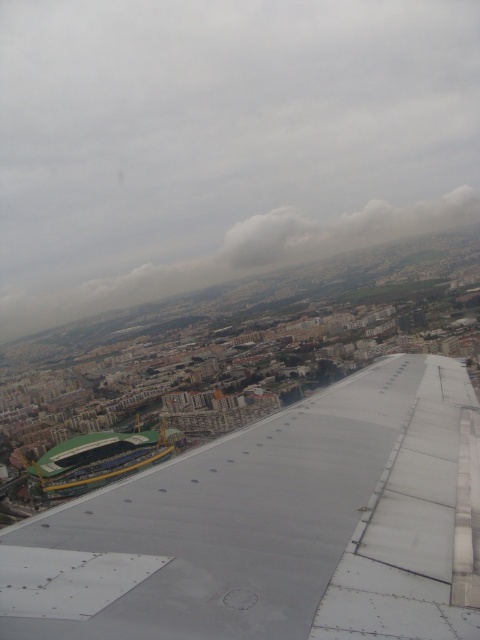
Is metallic gray wing at center wider than green plastic stadium at lower left?

Correct, the width of metallic gray wing at center exceeds that of green plastic stadium at lower left.

Is metallic gray wing at center behind green plastic stadium at lower left?

No, it is in front of green plastic stadium at lower left.

The width and height of the screenshot is (480, 640). Find the location of `metallic gray wing at center`. metallic gray wing at center is located at coordinates (276, 525).

Identify the location of metallic gray wing at center. The image size is (480, 640). (276, 525).

Is metallic gray wing at center shorter than white fluffy cloud at upper center?

Correct, metallic gray wing at center is not as tall as white fluffy cloud at upper center.

Which of these two, metallic gray wing at center or white fluffy cloud at upper center, stands taller?

white fluffy cloud at upper center

Between point (440, 616) and point (442, 204), which one is positioned behind?

Positioned behind is point (442, 204).

Locate an element on the screen. The image size is (480, 640). metallic gray wing at center is located at coordinates (276, 525).

Image resolution: width=480 pixels, height=640 pixels. What do you see at coordinates (338, 228) in the screenshot? I see `white fluffy cloud at upper center` at bounding box center [338, 228].

Who is more distant from viewer, (303, 218) or (92, 456)?

The point (303, 218) is behind.

Where is `white fluffy cloud at upper center`? white fluffy cloud at upper center is located at coordinates (x=338, y=228).

Locate an element on the screen. The height and width of the screenshot is (640, 480). white fluffy cloud at upper center is located at coordinates (338, 228).